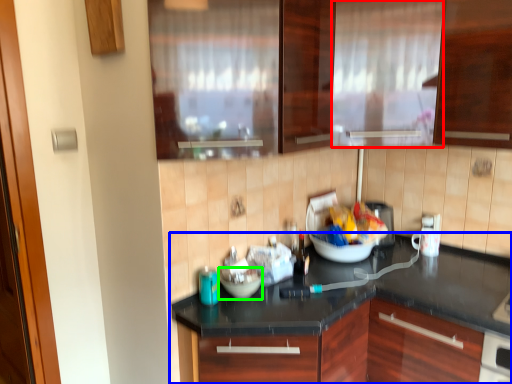
Question: Estimate the real-world distances between objects in this image. Which object is farther from curtain (highlighted by a red box), countertop (highlighted by a blue box) or bowl (highlighted by a green box)?

Choices:
 (A) countertop
 (B) bowl

Answer: (B)